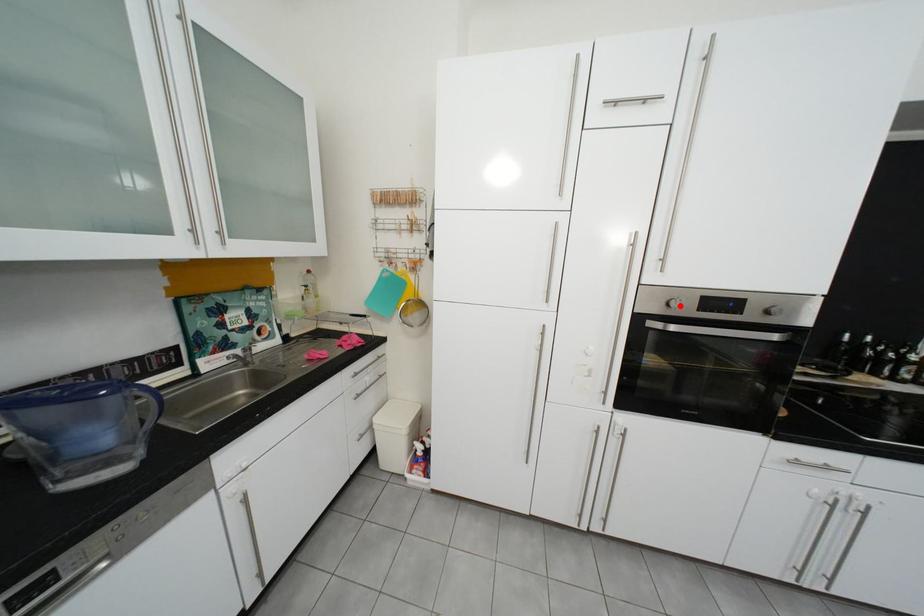
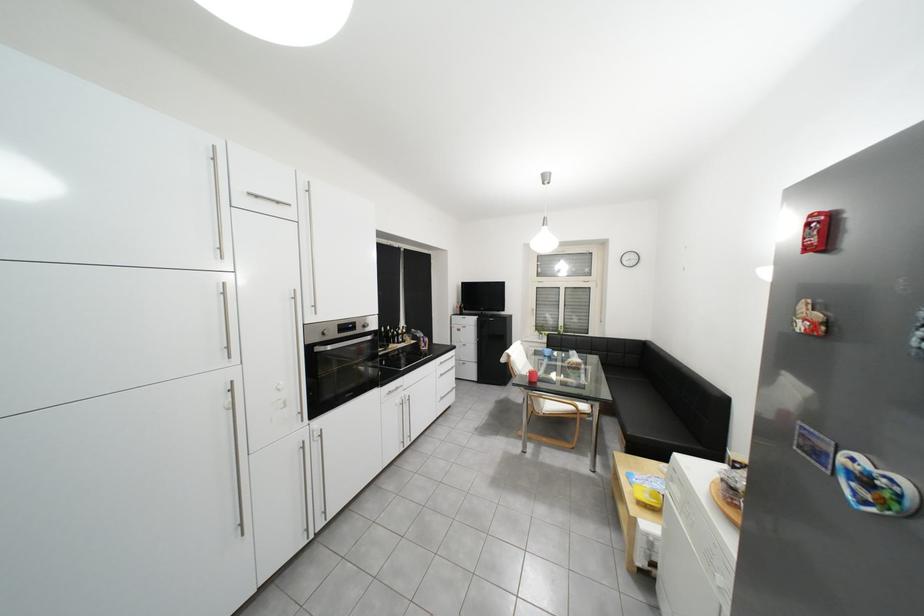
In the second image, find the point that corresponds to the highlighted location in the first image.

(334, 334)